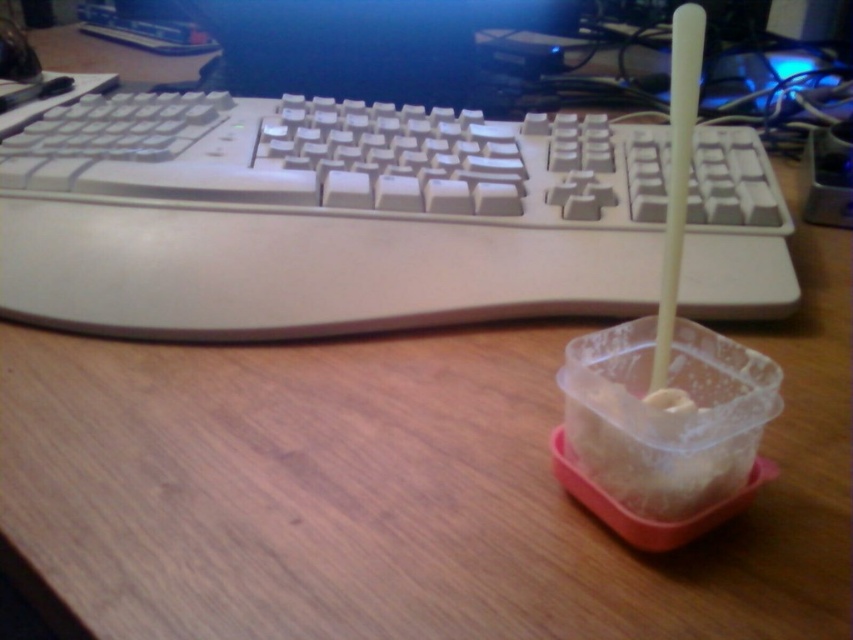
You are a delivery robot that needs to place a package on the desk. The package is 30 centimeters long. Can you safely place it in front of the white plastic keyboard at upper center without exceeding the desk space?

The white plastic keyboard at upper center is 34.62 centimeters away from the viewer. Since the package is 30 centimeters long, it can be placed in front of the keyboard as there is enough space between the keyboard and the edge of the desk.

From the picture: You are setting up a new desk arrangement and want to place a water bottle between the white plastic keyboard at upper center and the black plastic monitor at upper center. The water bottle has a diameter of 7 centimeters. Will there be enough space between them to fit the water bottle?

The distance between the white plastic keyboard at upper center and the black plastic monitor at upper center is 25.99 centimeters. Since the water bottle has a diameter of 7 centimeters, which is smaller than the available space, there is enough room to place the water bottle between them.

From the picture: You are setting up a desk organizer and want to place the white plastic keyboard at upper center and the white plastic straw at right in a drawer. The drawer has a width of 6 inches. Can both items fit side by side horizontally without overlapping?

The distance between the white plastic keyboard at upper center and the white plastic straw at right is 6.66 inches. Since the drawer is only 6 inches wide, the combined width of both items exceeds the drawer space. Therefore, they cannot fit side by side without overlapping.